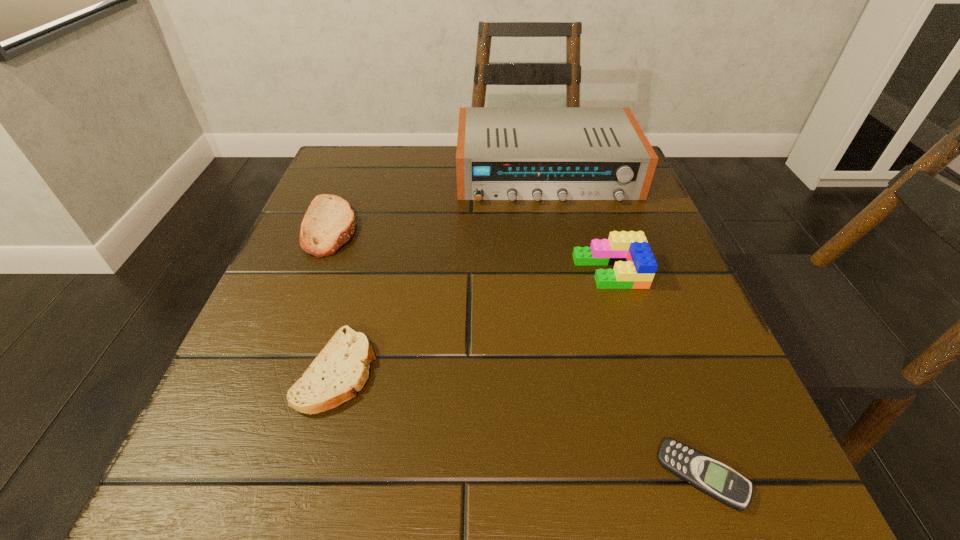
Locate an element on the screen. This screenshot has height=540, width=960. radio receiver is located at coordinates (503, 153).

Identify the location of Lego. (634, 264).

Where is `the taller pita bread`? the taller pita bread is located at coordinates (329, 222).

Find the location of a particular element. The width and height of the screenshot is (960, 540). the third shortest object is located at coordinates (329, 222).

Find the location of `the nearer pita bread`. the nearer pita bread is located at coordinates (341, 369).

Where is `the fourth farthest object`? The height and width of the screenshot is (540, 960). the fourth farthest object is located at coordinates (341, 369).

The image size is (960, 540). In order to click on beeper in this screenshot , I will do `click(708, 475)`.

This screenshot has width=960, height=540. What are the coordinates of `the nearest object` in the screenshot? It's located at (708, 475).

At what (x,y) coordinates should I click in order to perform the action: click on free spot located 0.070m on the front panel of the tallest object. Please return your answer as a coordinate pair (x, y). This screenshot has width=960, height=540. Looking at the image, I should click on (558, 227).

The image size is (960, 540). Identify the location of free space located 0.050m on the left of the fourth shortest object. (547, 271).